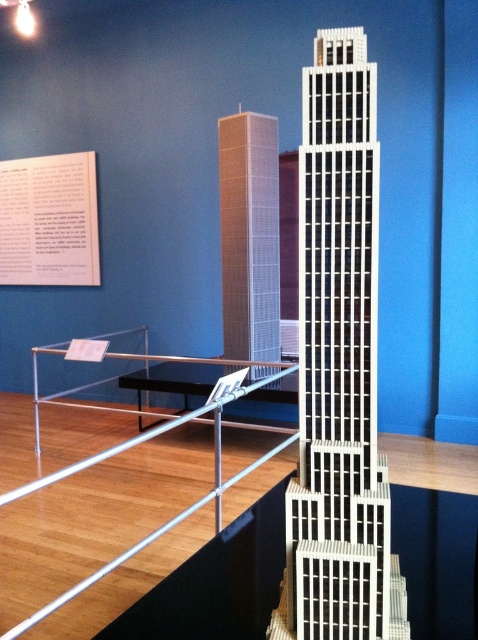
What do you see at coordinates (338, 365) in the screenshot? Image resolution: width=478 pixels, height=640 pixels. I see `white textured building at center` at bounding box center [338, 365].

Who is taller, white textured building at center or white grid-patterned tower at center?

Standing taller between the two is white grid-patterned tower at center.

Between point (346, 170) and point (259, 202), which one is positioned behind?

The point (259, 202) is behind.

What are the coordinates of `white textured building at center` in the screenshot? It's located at (338, 365).